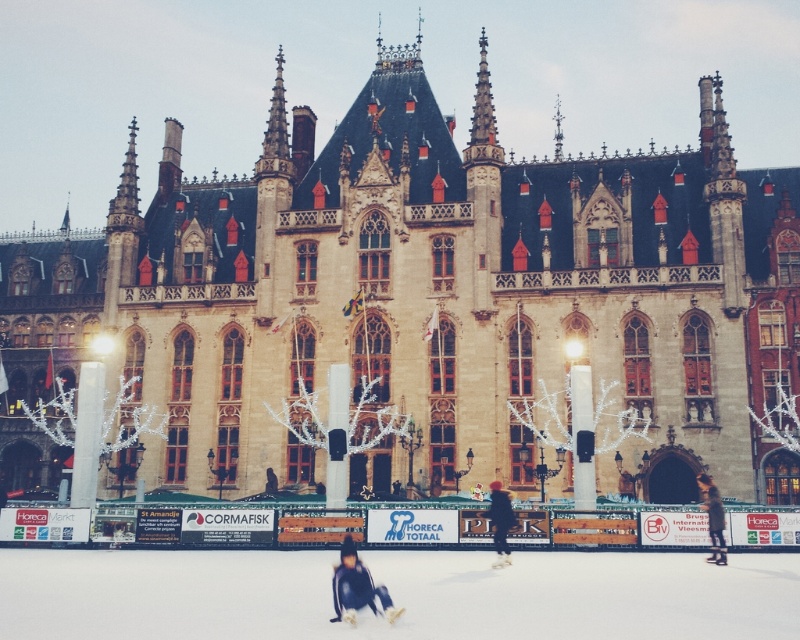
You are standing at the entrance of the historic building and want to reach the ice skating rink. Which point, point (345, 611) or point (498, 513), is closer to the rink?

Point (345, 611) is closer to the ice skating rink because it is in front of point (498, 513).

You are standing at the entrance of the historic building and see the dark blue fabric at center and the dark brown leather jacket at lower right. Which object is closer to the ground?

The dark blue fabric at center is positioned under the dark brown leather jacket at lower right, so it is closer to the ground.

You are organizing a winter event and need to decide which item to place first in the center of the ice skating rink. The items are the dark blue fabric at center and the dark brown leather jacket at lower right. Based on their sizes, which item should you prioritize placing first?

The dark blue fabric at center has a larger size compared to the dark brown leather jacket at lower right, so you should prioritize placing the dark blue fabric at center first due to its larger size.